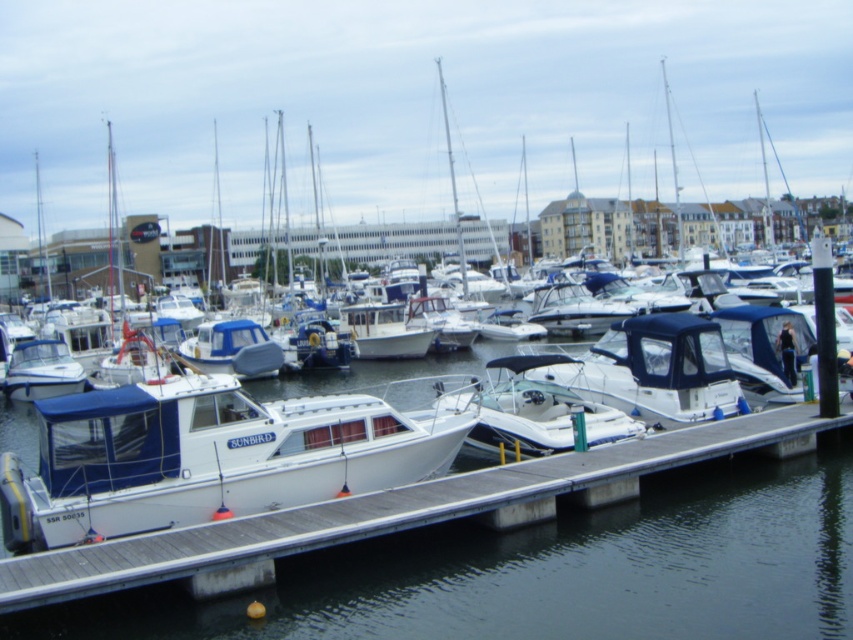
Does white wood dock at center have a lesser height compared to white matte boat at center?

No, white wood dock at center is not shorter than white matte boat at center.

Which is behind, point (720, 624) or point (325, 408)?

Point (325, 408)

Who is more forward, (699,588) or (308,404)?

Point (699,588)

Where is `white wood dock at center`? white wood dock at center is located at coordinates (550, 570).